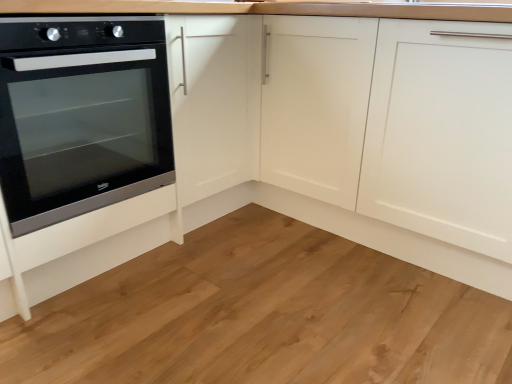
Question: From a real-world perspective, is black glass oven at left located beneath natural wood flooring at lower left?

Choices:
 (A) no
 (B) yes

Answer: (A)

Question: Can you confirm if black glass oven at left is shorter than natural wood flooring at lower left?

Choices:
 (A) yes
 (B) no

Answer: (B)

Question: Is black glass oven at left behind natural wood flooring at lower left?

Choices:
 (A) no
 (B) yes

Answer: (B)

Question: Is black glass oven at left facing towards natural wood flooring at lower left?

Choices:
 (A) no
 (B) yes

Answer: (A)

Question: Considering the relative positions of black glass oven at left and natural wood flooring at lower left in the image provided, is black glass oven at left to the right of natural wood flooring at lower left from the viewer's perspective?

Choices:
 (A) no
 (B) yes

Answer: (A)

Question: Is black glass oven at left wider than natural wood flooring at lower left?

Choices:
 (A) no
 (B) yes

Answer: (A)

Question: Does natural wood flooring at lower left have a lesser height compared to black glass oven at left?

Choices:
 (A) no
 (B) yes

Answer: (B)

Question: Is natural wood flooring at lower left taller than black glass oven at left?

Choices:
 (A) no
 (B) yes

Answer: (A)

Question: Is natural wood flooring at lower left behind black glass oven at left?

Choices:
 (A) yes
 (B) no

Answer: (B)

Question: Is natural wood flooring at lower left at the right side of black glass oven at left?

Choices:
 (A) no
 (B) yes

Answer: (B)

Question: Could black glass oven at left be considered to be inside natural wood flooring at lower left?

Choices:
 (A) no
 (B) yes

Answer: (A)

Question: Is natural wood flooring at lower left wider than black glass oven at left?

Choices:
 (A) no
 (B) yes

Answer: (B)

Question: Is point (132, 132) closer or farther from the camera than point (190, 284)?

Choices:
 (A) farther
 (B) closer

Answer: (A)